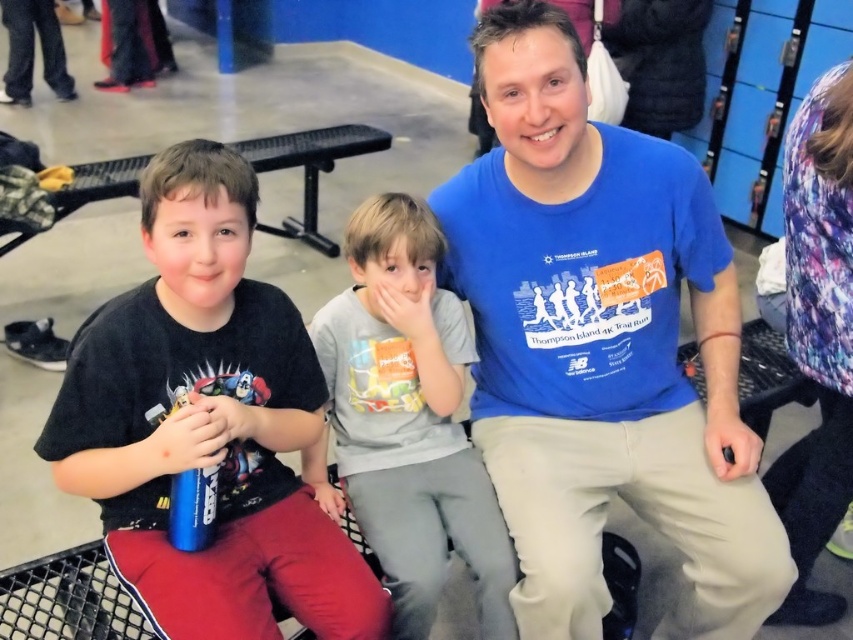
Question: Which of the following is the farthest from the observer?

Choices:
 (A) (601, 628)
 (B) (363, 512)
 (C) (312, 593)

Answer: (B)

Question: Is black matte shirt at left wider than gray cotton shirt at center?

Choices:
 (A) yes
 (B) no

Answer: (A)

Question: Which point is closer to the camera?

Choices:
 (A) black matte shirt at left
 (B) blue cotton t-shirt at center
 (C) gray cotton shirt at center

Answer: (A)

Question: Does black matte shirt at left have a greater width compared to gray cotton shirt at center?

Choices:
 (A) no
 (B) yes

Answer: (B)

Question: Which point appears farthest from the camera in this image?

Choices:
 (A) (440, 492)
 (B) (201, 572)

Answer: (A)

Question: Can you confirm if blue cotton t-shirt at center is positioned above gray cotton shirt at center?

Choices:
 (A) yes
 (B) no

Answer: (A)